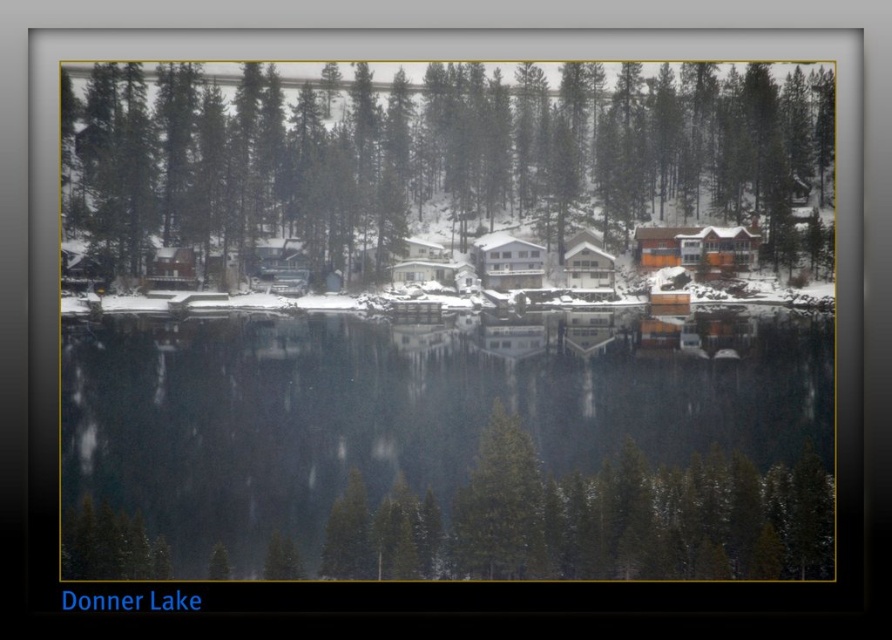
This screenshot has width=892, height=640. Identify the location of clear water at center. (442, 451).

Who is more forward, (787, 378) or (230, 120)?

Positioned in front is point (787, 378).

Between point (716, 557) and point (769, 120), which one is positioned in front?

Point (716, 557) is more forward.

Locate an element on the screen. Image resolution: width=892 pixels, height=640 pixels. clear water at center is located at coordinates (442, 451).